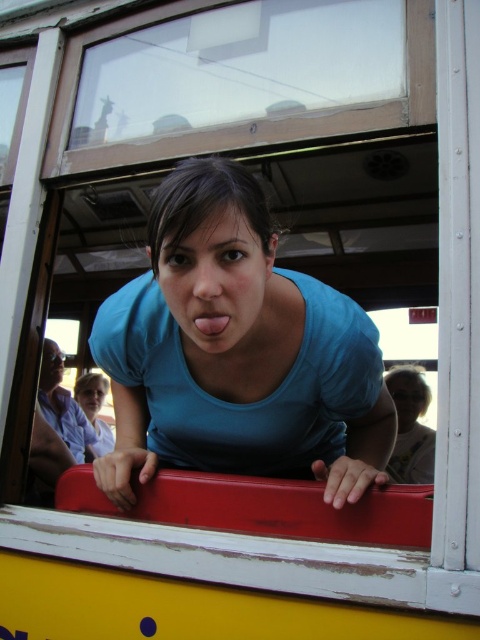
You are standing 3 feet away from the tram window. There is a point at coordinates point (295, 397). Can you reach that point with your hand?

The distance of point (295, 397) from viewer is 4.11 feet, so you are 3 feet away from the tram window but the point is 4.11 feet away, meaning you cannot reach it with your hand.

You are a passenger on the tram and want to know if the point at coordinates point (389,464) is behind point (223,314). Can you determine this based on your position inside the tram?

Yes, according to the description, point (389,464) is behind point (223,314).